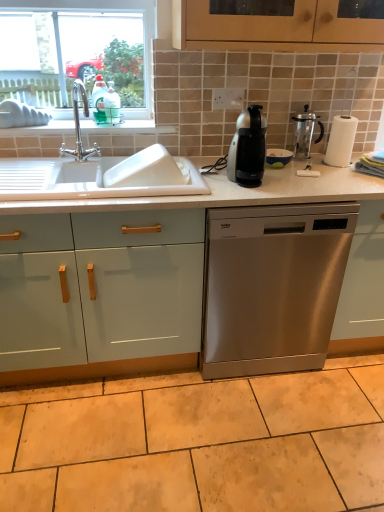
This screenshot has height=512, width=384. Find the location of `empty space that is ontop of mint glossy cabinet doors at lower left`. empty space that is ontop of mint glossy cabinet doors at lower left is located at coordinates (67, 184).